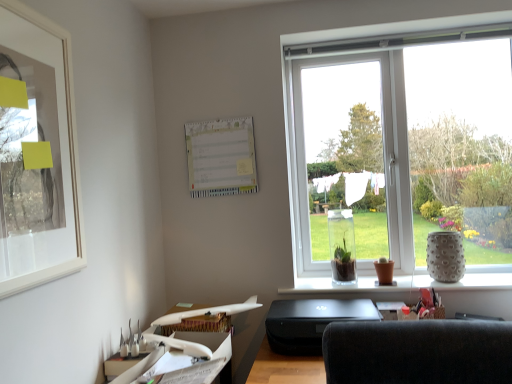
Question: From a real-world perspective, relative to black matte printer at lower center, is white matte picture frame at upper left vertically above or below?

Choices:
 (A) above
 (B) below

Answer: (A)

Question: Based on their sizes in the image, would you say white matte picture frame at upper left is bigger or smaller than black matte printer at lower center?

Choices:
 (A) big
 (B) small

Answer: (B)

Question: Estimate the real-world distances between objects in this image. Which object is closer to the clear glass vase at center?

Choices:
 (A) white matte picture frame at upper left
 (B) white plastic airplane at lower left
 (C) white paper calendar at upper center
 (D) speckled ceramic vase at right
 (E) black matte printer at lower center

Answer: (D)

Question: Which object is positioned farthest from the white plastic airplane at lower left?

Choices:
 (A) speckled ceramic vase at right
 (B) clear glass vase at center
 (C) black matte printer at lower center
 (D) white paper calendar at upper center
 (E) white matte picture frame at upper left

Answer: (A)